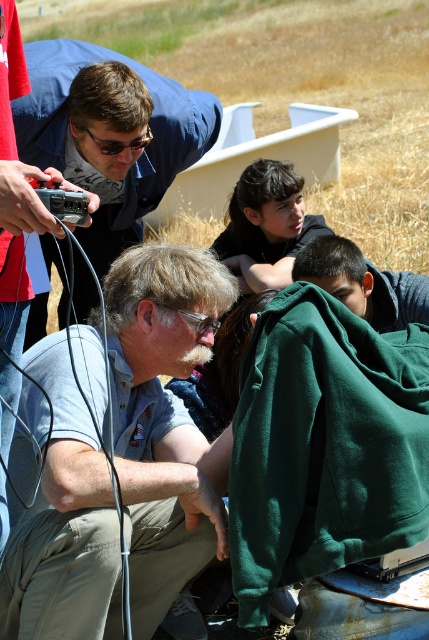
Question: Which of the following is the farthest from the observer?

Choices:
 (A) dark brown hair at center
 (B) gray cotton shirt at center

Answer: (A)

Question: Which point is closer to the camera?

Choices:
 (A) matte black camera at upper left
 (B) green fleece blanket at lower right

Answer: (B)

Question: Is gray cotton shirt at center bigger than matte black camera at left?

Choices:
 (A) no
 (B) yes

Answer: (B)

Question: Among these objects, which one is nearest to the camera?

Choices:
 (A) dark brown hair at center
 (B) dark green hoodie at lower right
 (C) matte black camera at left
 (D) gray cotton shirt at center

Answer: (C)

Question: Does matte black camera at upper left appear over matte black camera at left?

Choices:
 (A) yes
 (B) no

Answer: (A)

Question: Is green fleece blanket at lower right bigger than dark green hoodie at lower right?

Choices:
 (A) yes
 (B) no

Answer: (A)